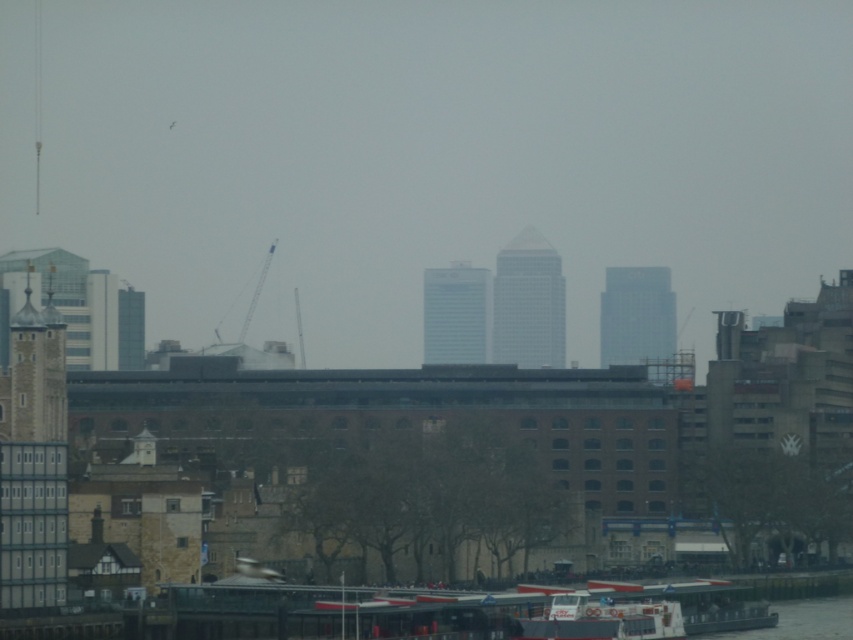
Question: Can you confirm if glassy silver skyscraper at center is positioned to the right of glassy reflective skyscraper at left?

Choices:
 (A) yes
 (B) no

Answer: (A)

Question: Estimate the real-world distances between objects in this image. Which object is farther from the light blue glass skyscraper at center?

Choices:
 (A) glassy reflective skyscraper at left
 (B) stone tower at left

Answer: (B)

Question: Which is farther from the glassy reflective skyscraper at left?

Choices:
 (A) glassy silver skyscraper at center
 (B) light blue glass skyscraper at center
 (C) glassy gray skyscraper at center

Answer: (C)

Question: Does stone tower at left appear on the right side of glassy gray skyscraper at center?

Choices:
 (A) no
 (B) yes

Answer: (A)

Question: Among these objects, which one is farthest from the camera?

Choices:
 (A) glassy gray skyscraper at center
 (B) light blue glass skyscraper at center
 (C) glassy silver skyscraper at center

Answer: (B)

Question: Is glassy silver skyscraper at center bigger than stone tower at left?

Choices:
 (A) no
 (B) yes

Answer: (A)